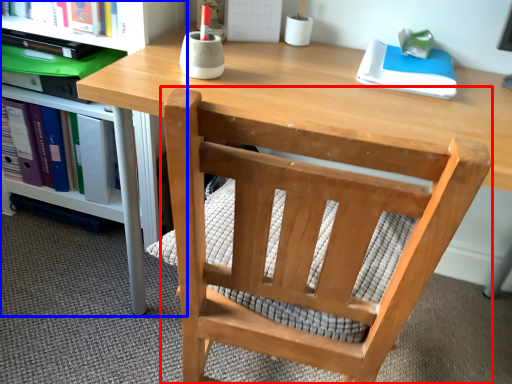
Question: Which object is closer to the camera taking this photo, chair (highlighted by a red box) or shelf (highlighted by a blue box)?

Choices:
 (A) chair
 (B) shelf

Answer: (A)